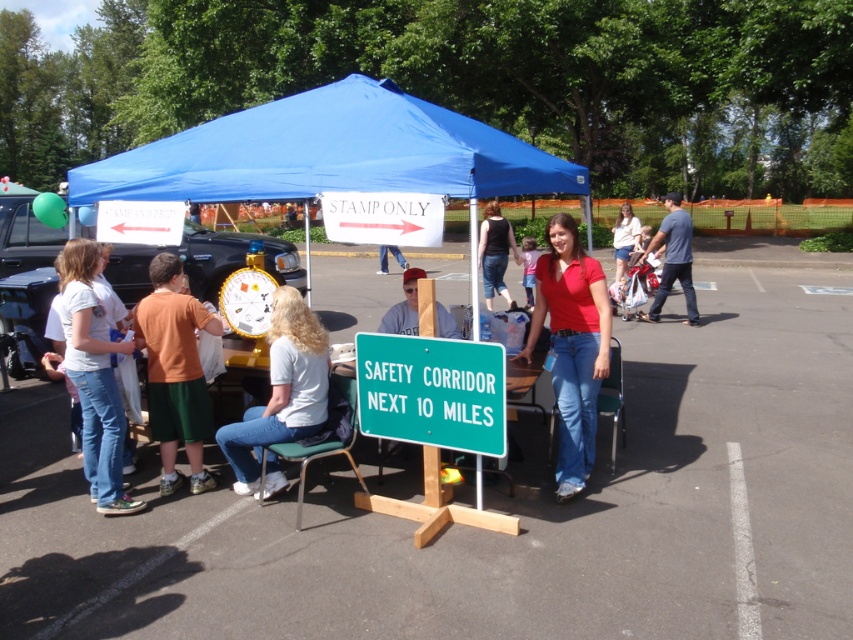
In the scene shown: Is red cotton shirt at center above white fabric clock at center?

Indeed, red cotton shirt at center is positioned over white fabric clock at center.

Between red cotton shirt at center and white fabric clock at center, which one has more height?

red cotton shirt at center

Measure the distance between point (596, 266) and camera.

The distance of point (596, 266) from camera is 4.82 meters.

Image resolution: width=853 pixels, height=640 pixels. I want to click on red cotton shirt at center, so click(x=572, y=346).

Who is lower down, green metal sign at center or denim shorts at center?

green metal sign at center is lower down.

Between green metal sign at center and denim shorts at center, which one is positioned higher?

denim shorts at center

Describe the element at coordinates (500, 508) in the screenshot. This screenshot has height=640, width=853. I see `green metal sign at center` at that location.

The image size is (853, 640). What are the coordinates of `green metal sign at center` in the screenshot? It's located at (500, 508).

Is white fabric clock at center above white cotton shirt at left?

No.

Between white fabric clock at center and white cotton shirt at left, which one appears on the right side from the viewer's perspective?

Positioned to the right is white fabric clock at center.

The height and width of the screenshot is (640, 853). What do you see at coordinates (282, 388) in the screenshot? I see `white fabric clock at center` at bounding box center [282, 388].

Locate an element on the screen. white fabric clock at center is located at coordinates click(x=282, y=388).